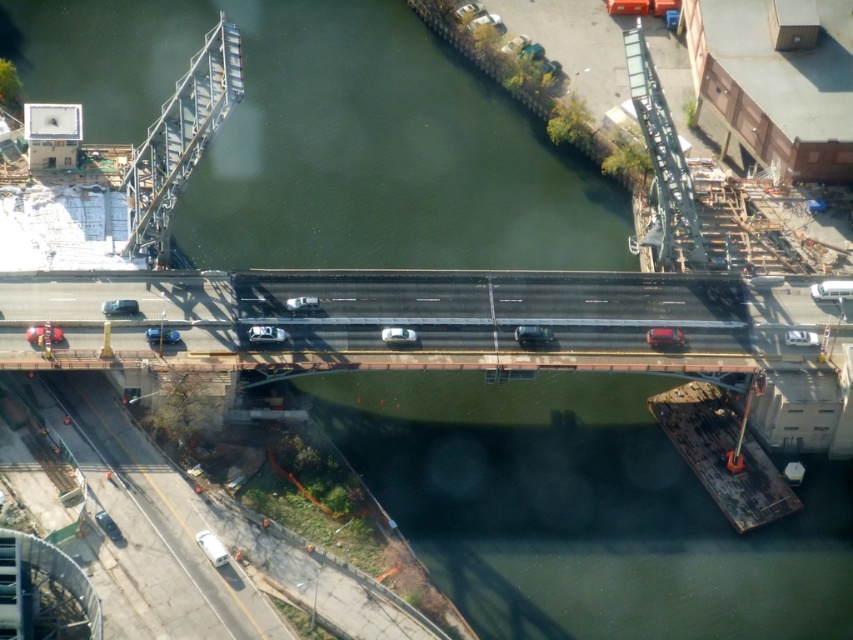
Which is above, white glossy van at center or shiny red sedan at center?

Positioned higher is white glossy van at center.

Is point (822, 285) in front of point (677, 340)?

No, it is not.

Identify the location of white glossy van at center. (831, 289).

Which is more to the right, white glossy van at lower left or white matte car at center?

white matte car at center

Who is more distant from viewer, [206,545] or [318,305]?

The point [318,305] is behind.

Where is `white glossy van at lower left`? This screenshot has width=853, height=640. white glossy van at lower left is located at coordinates (212, 547).

Which is in front, point (517, 339) or point (468, 17)?

Point (517, 339) is more forward.

Does matte silver sedan at center appear on the left side of matte silver sedan at upper center?

No, matte silver sedan at center is not to the left of matte silver sedan at upper center.

Which is behind, point (523, 324) or point (471, 3)?

The point (471, 3) is more distant.

Locate an element on the screen. The width and height of the screenshot is (853, 640). matte silver sedan at center is located at coordinates (532, 336).